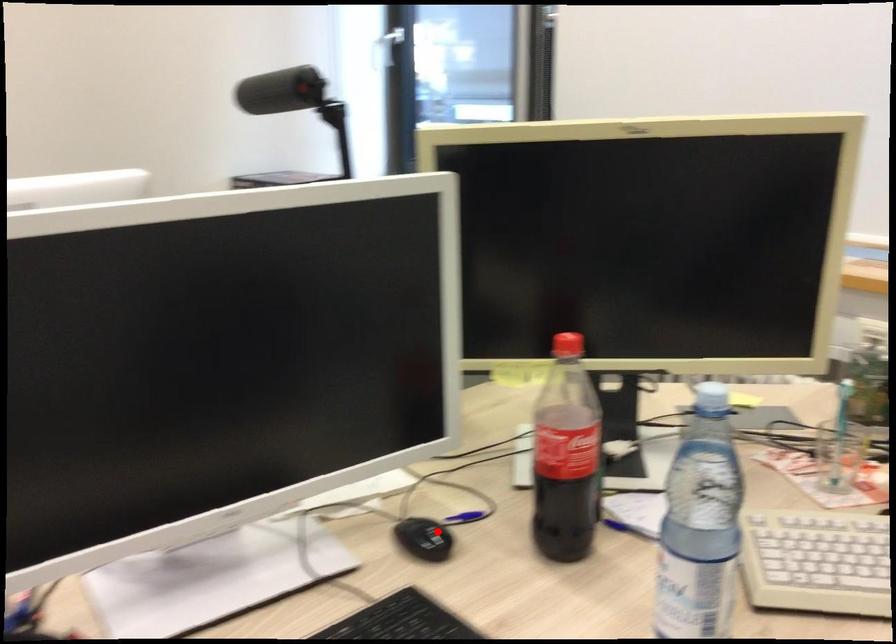
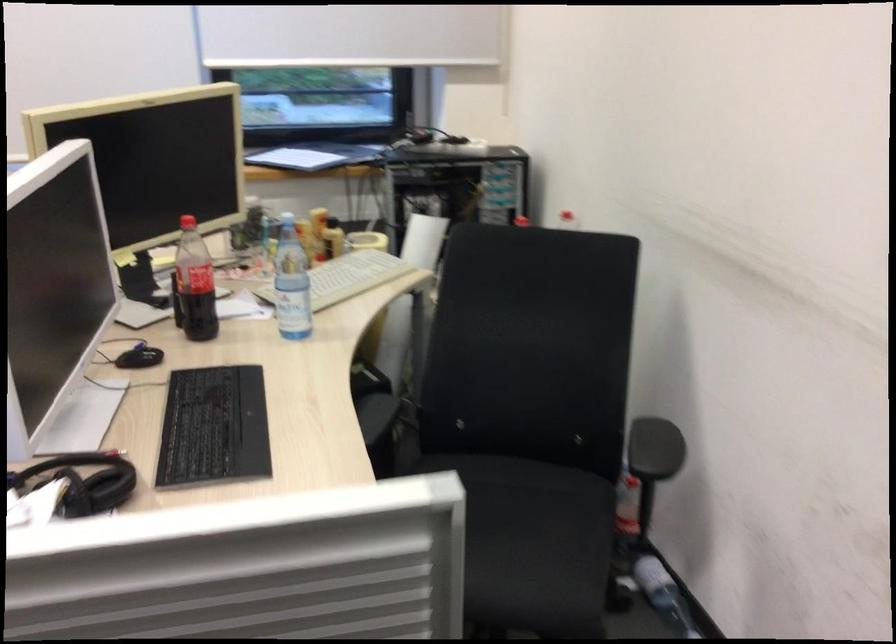
The point at the highlighted location is marked in the first image. Where is the corresponding point in the second image?

(140, 357)